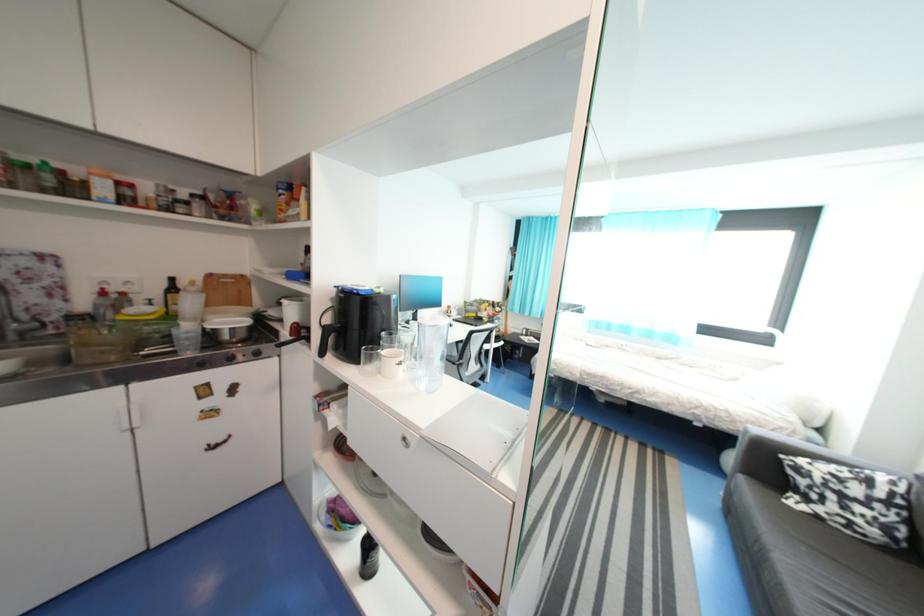
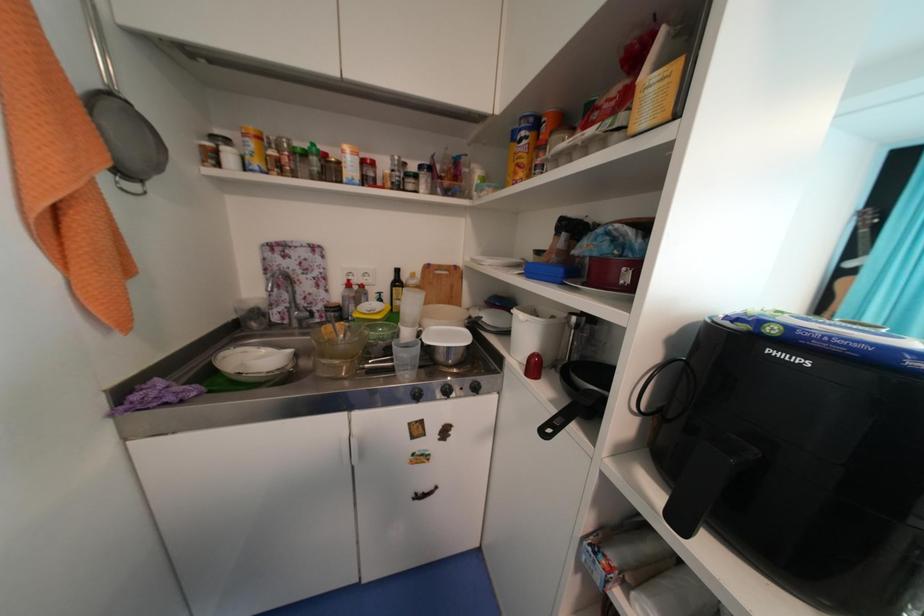
Question: The camera is either moving clockwise (left) or counter-clockwise (right) around the object. The first image is from the beginning of the video and the second image is from the end. Is the camera moving left or right when shooting the video?

Choices:
 (A) Left
 (B) Right

Answer: (B)